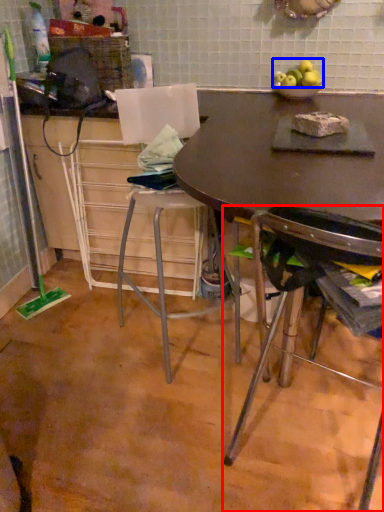
Question: Which object appears closest to the camera in this image, chair (highlighted by a red box) or apple (highlighted by a blue box)?

Choices:
 (A) chair
 (B) apple

Answer: (A)